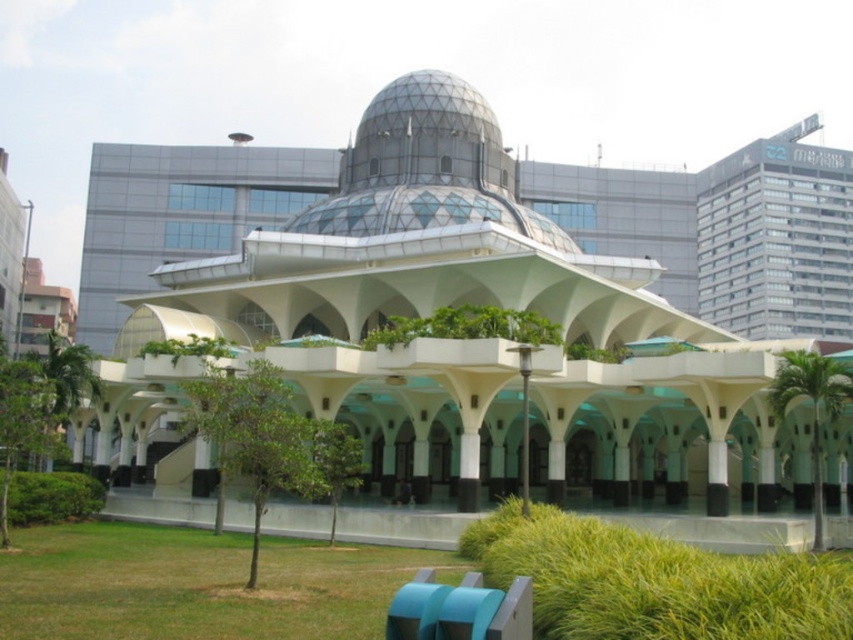
Question: Is the position of green grass at lower left less distant than that of green grass at lower center?

Choices:
 (A) no
 (B) yes

Answer: (A)

Question: Which point appears farthest from the camera in this image?

Choices:
 (A) (160, 589)
 (B) (654, 556)

Answer: (A)

Question: Where is green grass at lower left located in relation to green grass at lower center in the image?

Choices:
 (A) below
 (B) above

Answer: (A)

Question: Can you confirm if green grass at lower left is wider than green grass at lower center?

Choices:
 (A) yes
 (B) no

Answer: (A)

Question: Which of the following is the closest to the observer?

Choices:
 (A) (550, 518)
 (B) (163, 568)

Answer: (B)

Question: Among these points, which one is farthest from the camera?

Choices:
 (A) (560, 637)
 (B) (33, 612)

Answer: (B)